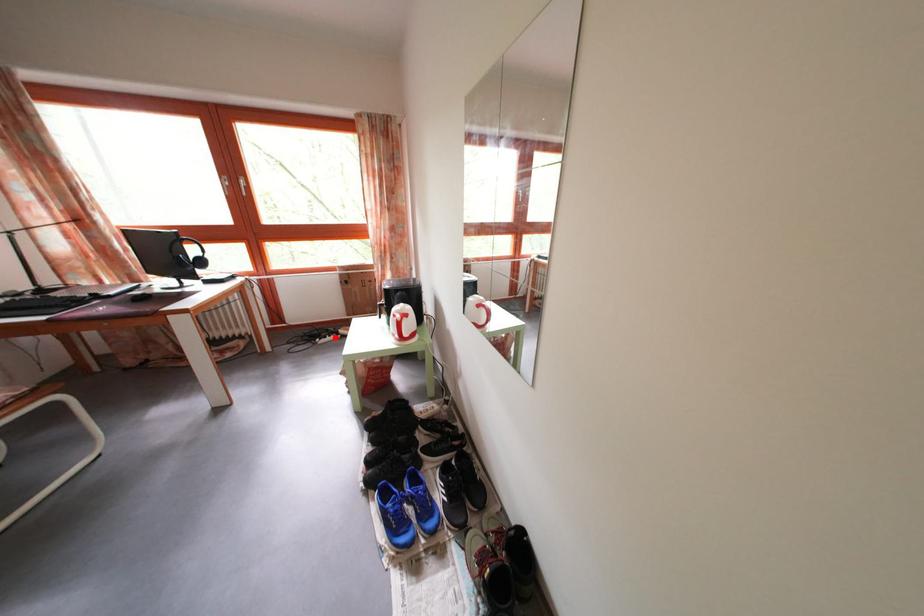
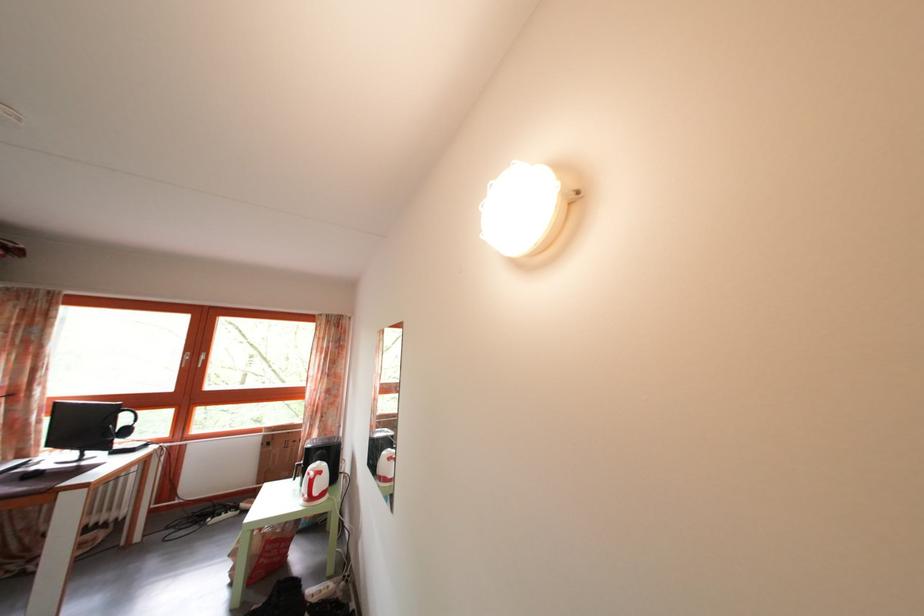
Where in the second image is the point corresponding to the highlighted location from the first image?

(233, 514)